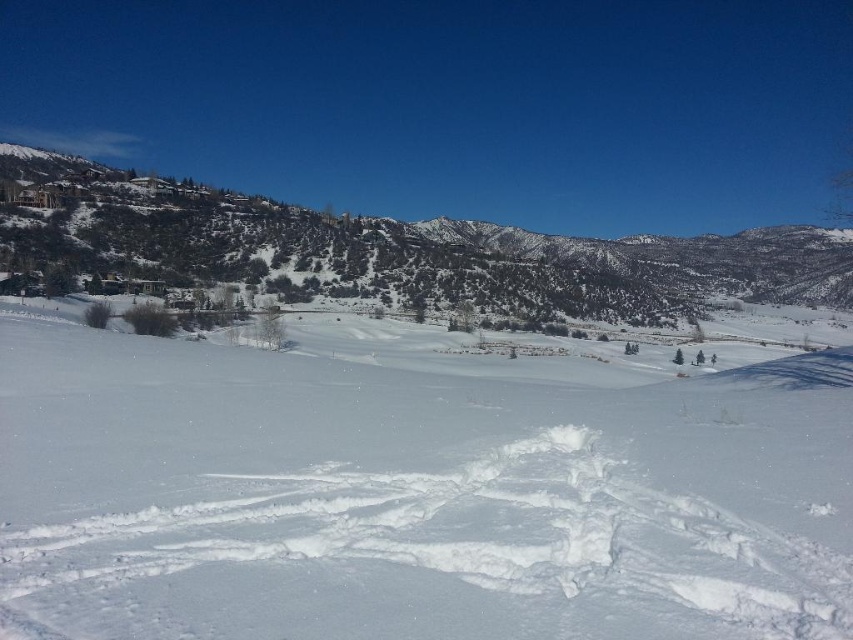
Can you confirm if white fluffy snow at center is positioned to the right of green textured hillside at upper left?

In fact, white fluffy snow at center is to the left of green textured hillside at upper left.

What do you see at coordinates (416, 490) in the screenshot?
I see `white fluffy snow at center` at bounding box center [416, 490].

Is point (752, 580) farther from viewer compared to point (194, 193)?

No, (752, 580) is closer to viewer.

You are a GUI agent. You are given a task and a screenshot of the screen. Output one action in this format:
    pyautogui.click(x=<x>, y=<y>)
    Task: Click on the white fluffy snow at center
    The height and width of the screenshot is (640, 853).
    Given the screenshot: What is the action you would take?
    pyautogui.click(x=416, y=490)